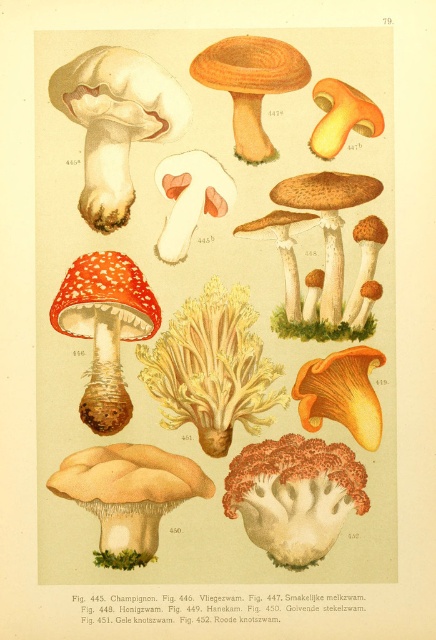
Question: Which object appears farthest from the camera in this image?

Choices:
 (A) matte white mushroom at upper left
 (B) beige matte mushroom at lower left
 (C) white fluffy fungus at center
 (D) smooth orange mushroom at center

Answer: (C)

Question: Does orange coral-like fungus at center have a greater width compared to brown matte mushroom at center?

Choices:
 (A) no
 (B) yes

Answer: (B)

Question: Which point is closer to the camera?

Choices:
 (A) smooth orange mushroom at center
 (B) matte white mushroom at upper left
 (C) beige matte mushroom at lower left
 (D) orange coral-like fungus at center

Answer: (D)

Question: Which point is farther from the camera taking this photo?

Choices:
 (A) (200, 344)
 (B) (166, 83)
 (C) (198, 52)

Answer: (A)

Question: Does smooth orange cap at center appear on the right side of smooth yellow mushroom at upper right?

Choices:
 (A) yes
 (B) no

Answer: (B)

Question: Is white fluffy fungus at center below brown matte mushroom at center?

Choices:
 (A) no
 (B) yes

Answer: (B)